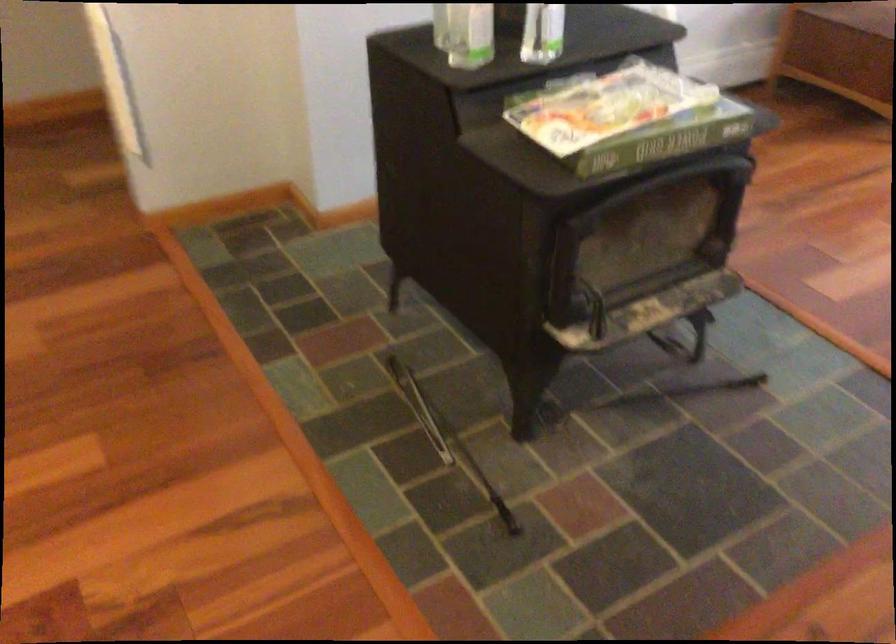
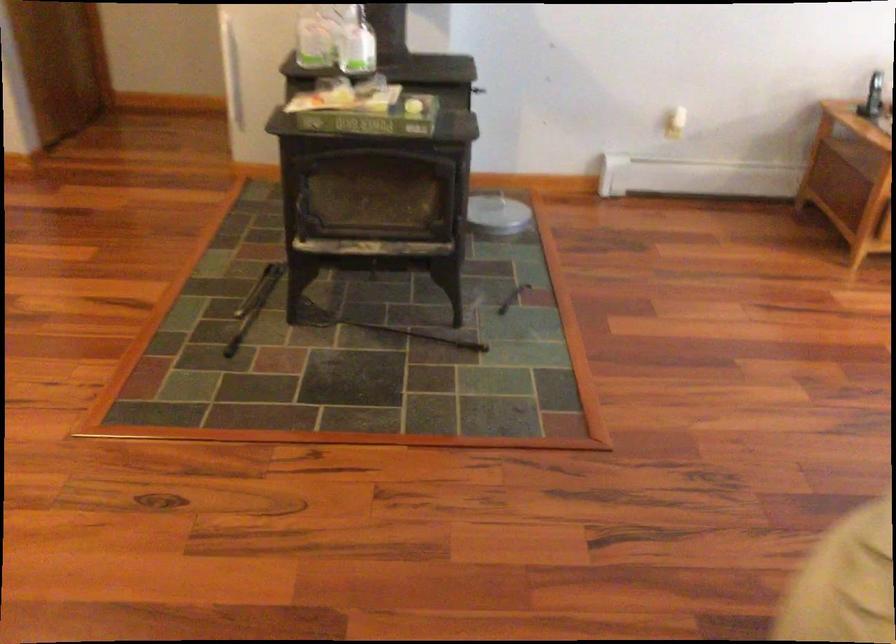
Question: I am providing you with two images of the same scene from different viewpoints. After the viewpoint changes to image2, which objects are now occluded?

Choices:
 (A) black metal tool
 (B) black fireplace tool
 (C) stove door handle
 (D) none of these

Answer: (D)